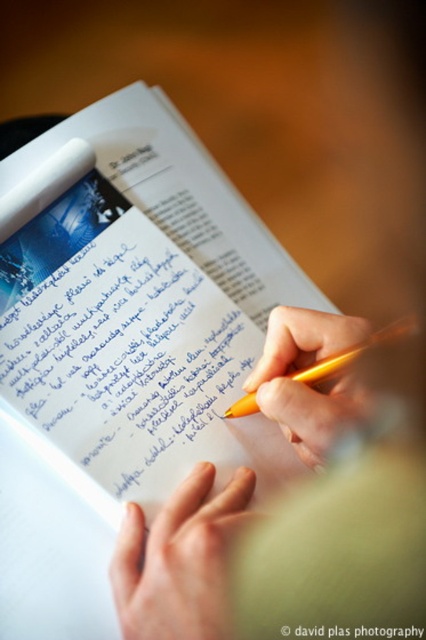
You are an observer looking at the scene of someone writing. Which object is positioned lower between the smooth skin hand at center and the yellow plastic pen at center?

The smooth skin hand at center is located below the yellow plastic pen at center, so it is positioned lower.

You are a photographer trying to capture a close detail of the notebook. The camera is currently positioned at point (218, 518). If you want to focus on the printed text and handwritten notes on the notebook, should you move the camera closer or farther away?

The camera is currently 17.49 inches away from the point (218, 518). To focus on the printed text and handwritten notes, you should move the camera closer to the notebook because the shallow depth of field requires a closer distance to capture fine details.

In the scene shown: You are a photographer trying to capture a detailed shot of the yellow plastic pen at center. The smooth skin hand at center is partially blocking your view. Can you determine which object you need to adjust to get a clearer view of the pen?

The smooth skin hand at center has a lesser height compared to yellow plastic pen at center, so you need to adjust the smooth skin hand at center to move it out of the way to get a clearer view of the pen.